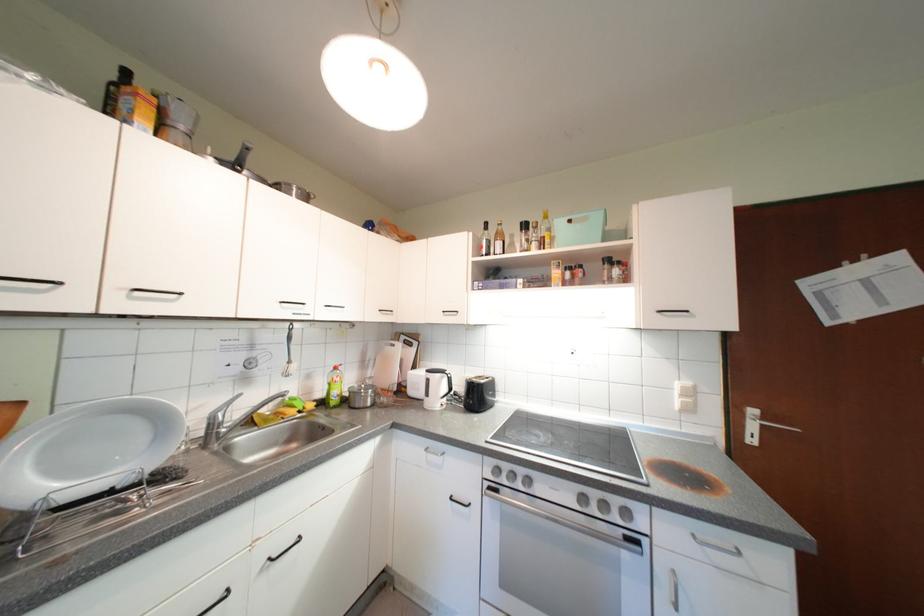
Where would you push the dish soap pump? Please return your answer as a coordinate pair (x, y).

(336, 368)